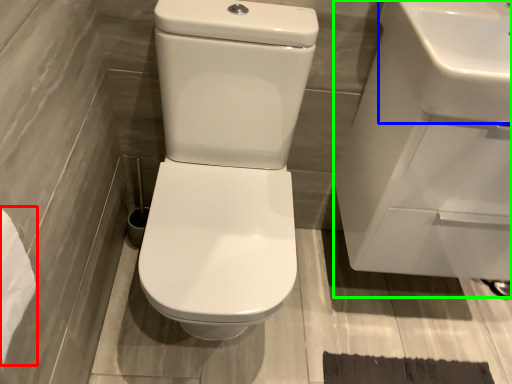
Question: Considering the real-world distances, which object is closest to toilet paper (highlighted by a red box)? sink (highlighted by a blue box) or sink (highlighted by a green box).

Choices:
 (A) sink
 (B) sink

Answer: (A)